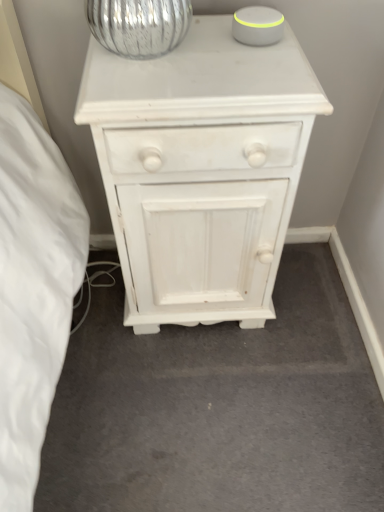
Where is `white painted wood chest of drawers at center`? The height and width of the screenshot is (512, 384). white painted wood chest of drawers at center is located at coordinates (x=201, y=170).

Describe the element at coordinates (201, 170) in the screenshot. I see `white painted wood chest of drawers at center` at that location.

Identify the location of white painted wood chest of drawers at center. The image size is (384, 512). (201, 170).